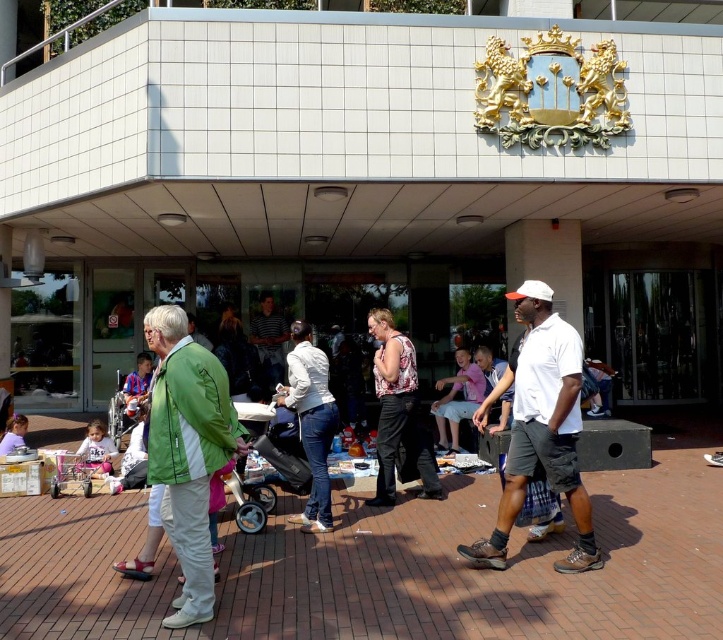
This screenshot has width=723, height=640. Describe the element at coordinates (385, 568) in the screenshot. I see `brick pavement at center` at that location.

Which is in front, point (223, 589) or point (200, 497)?

Positioned in front is point (200, 497).

Between point (641, 595) and point (147, 436), which one is positioned behind?

The point (147, 436) is behind.

The height and width of the screenshot is (640, 723). What are the coordinates of `brick pavement at center` in the screenshot? It's located at (385, 568).

Can you confirm if light brown wooden chair at lower left is smaller than matte blue shirt at lower left?

Indeed, light brown wooden chair at lower left has a smaller size compared to matte blue shirt at lower left.

Which is more to the left, light brown wooden chair at lower left or matte blue shirt at lower left?

From the viewer's perspective, light brown wooden chair at lower left appears more on the left side.

Does point (85, 460) lie in front of point (134, 397)?

Yes.

In order to click on light brown wooden chair at lower left in this screenshot , I will do coord(98,449).

Which is in front, point (458, 516) or point (330, 419)?

Point (330, 419)

Can you confirm if brick pavement at center is shorter than white matte jacket at center?

Yes, brick pavement at center is shorter than white matte jacket at center.

The height and width of the screenshot is (640, 723). What are the coordinates of `brick pavement at center` in the screenshot? It's located at (385, 568).